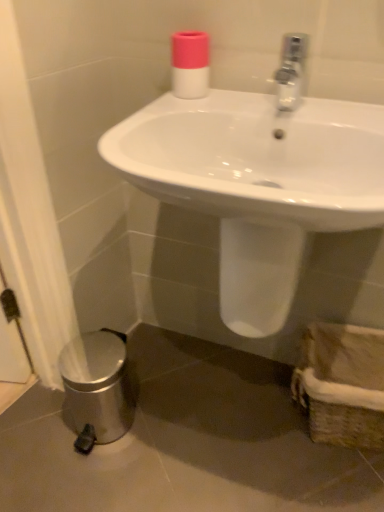
Locate an element on the screen. brown woven basket at lower right is located at coordinates coord(342,384).

The image size is (384, 512). Find the location of `pink matte bottle at upper center`. pink matte bottle at upper center is located at coordinates (190, 64).

Is pink matte bottle at upper center next to white glossy sink at center and touching it?

No, pink matte bottle at upper center is not next to white glossy sink at center.

From a real-world perspective, who is located higher, pink matte bottle at upper center or white glossy sink at center?

pink matte bottle at upper center, from a real-world perspective.

Is pink matte bottle at upper center looking in the opposite direction of white glossy sink at center?

No, pink matte bottle at upper center is not facing away from white glossy sink at center.

Between point (180, 81) and point (245, 106), which one is positioned in front?

The point (245, 106) is in front.

Which is more to the right, white glossy sink at center or pink matte bottle at upper center?

white glossy sink at center.

Considering the sizes of objects white glossy sink at center and pink matte bottle at upper center in the image provided, who is shorter, white glossy sink at center or pink matte bottle at upper center?

pink matte bottle at upper center.

Considering their positions, is white glossy sink at center located in front of or behind pink matte bottle at upper center?

Visually, white glossy sink at center is located in front of pink matte bottle at upper center.

From the image's perspective, is pink matte bottle at upper center on brown woven basket at lower right?

Yes.

Is pink matte bottle at upper center turned away from brown woven basket at lower right?

No, pink matte bottle at upper center is not facing the opposite direction of brown woven basket at lower right.

Considering the positions of objects pink matte bottle at upper center and brown woven basket at lower right in the image provided, who is more to the left, pink matte bottle at upper center or brown woven basket at lower right?

Positioned to the left is pink matte bottle at upper center.

Is pink matte bottle at upper center wider than brown woven basket at lower right?

Incorrect, the width of pink matte bottle at upper center does not surpass that of brown woven basket at lower right.

From a real-world perspective, which is physically below, brown woven basket at lower right or pink matte bottle at upper center?

brown woven basket at lower right, from a real-world perspective.

How distant is brown woven basket at lower right from pink matte bottle at upper center?

brown woven basket at lower right and pink matte bottle at upper center are 30.36 inches apart.

Does point (332, 430) lie in front of point (197, 45)?

No, it is not.

Would you say brown woven basket at lower right is to the left or to the right of pink matte bottle at upper center in the picture?

In the image, brown woven basket at lower right appears on the right side of pink matte bottle at upper center.

Does point (253, 276) come behind point (309, 383)?

No, it is in front of (309, 383).

Consider the image. Is white glossy sink at center wider than brown woven basket at lower right?

Yes, white glossy sink at center is wider than brown woven basket at lower right.

Can brown woven basket at lower right be found inside white glossy sink at center?

Definitely not — brown woven basket at lower right is not inside white glossy sink at center.

Considering the sizes of objects brown woven basket at lower right and white glossy sink at center in the image provided, who is smaller, brown woven basket at lower right or white glossy sink at center?

With smaller size is brown woven basket at lower right.

How much distance is there between brown woven basket at lower right and white glossy sink at center?

brown woven basket at lower right and white glossy sink at center are 17.04 inches apart.

Is the depth of brown woven basket at lower right greater than that of white glossy sink at center?

Yes, brown woven basket at lower right is further from the viewer.

Is brown woven basket at lower right next to white glossy sink at center and touching it?

No, brown woven basket at lower right is not with white glossy sink at center.

The width and height of the screenshot is (384, 512). I want to click on toiletry above the white glossy sink at center (from a real-world perspective), so click(x=190, y=64).

Find the location of `toiletry that appears above the white glossy sink at center (from the image's perspective)`. toiletry that appears above the white glossy sink at center (from the image's perspective) is located at coordinates (190, 64).

Estimate the real-world distances between objects in this image. Which object is closer to pink matte bottle at upper center, white glossy sink at center or brown woven basket at lower right?

white glossy sink at center is positioned closer to the anchor pink matte bottle at upper center.

In the scene shown: When comparing their distances from brown woven basket at lower right, does white glossy sink at center or pink matte bottle at upper center seem closer?

The object closer to brown woven basket at lower right is white glossy sink at center.

Consider the image. Based on their spatial positions, is pink matte bottle at upper center or brown woven basket at lower right further from white glossy sink at center?

brown woven basket at lower right is positioned further to the anchor white glossy sink at center.

Looking at this image, which object lies nearer to the anchor point pink matte bottle at upper center, brown woven basket at lower right or white glossy sink at center?

The object closer to pink matte bottle at upper center is white glossy sink at center.

When comparing their distances from brown woven basket at lower right, does pink matte bottle at upper center or white glossy sink at center seem further?

Among the two, pink matte bottle at upper center is located further to brown woven basket at lower right.

Looking at the image, which one is located further to white glossy sink at center, brown woven basket at lower right or pink matte bottle at upper center?

Among the two, brown woven basket at lower right is located further to white glossy sink at center.

Where is `sink between pink matte bottle at upper center and brown woven basket at lower right in the up-down direction`? sink between pink matte bottle at upper center and brown woven basket at lower right in the up-down direction is located at coordinates (259, 179).